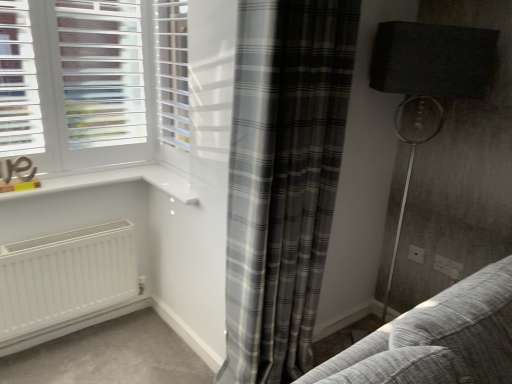
Question: Does white plastic blinds at upper center have a lesser height compared to matte black lampshade at right?

Choices:
 (A) no
 (B) yes

Answer: (B)

Question: Is white plastic blinds at upper center outside matte black lampshade at right?

Choices:
 (A) no
 (B) yes

Answer: (B)

Question: Does white plastic blinds at upper center have a lesser width compared to matte black lampshade at right?

Choices:
 (A) no
 (B) yes

Answer: (B)

Question: Is white plastic blinds at upper center in front of matte black lampshade at right?

Choices:
 (A) no
 (B) yes

Answer: (A)

Question: Is white plastic blinds at upper center bigger than matte black lampshade at right?

Choices:
 (A) no
 (B) yes

Answer: (A)

Question: From the image's perspective, relative to matte black lampshade at right, is gray plaid curtain at center above or below?

Choices:
 (A) below
 (B) above

Answer: (A)

Question: In terms of height, does gray plaid curtain at center look taller or shorter compared to matte black lampshade at right?

Choices:
 (A) short
 (B) tall

Answer: (B)

Question: Considering the relative positions of gray plaid curtain at center and matte black lampshade at right in the image provided, is gray plaid curtain at center to the left or to the right of matte black lampshade at right?

Choices:
 (A) left
 (B) right

Answer: (A)

Question: From a real-world perspective, is gray plaid curtain at center positioned above or below matte black lampshade at right?

Choices:
 (A) above
 (B) below

Answer: (A)

Question: Based on their positions, is matte black lampshade at right located to the left or right of white plastic electric outlet at lower right, the first electric outlet in the right-to-left sequence?

Choices:
 (A) left
 (B) right

Answer: (A)

Question: From the image's perspective, relative to white plastic electric outlet at lower right, the first electric outlet in the right-to-left sequence, is matte black lampshade at right above or below?

Choices:
 (A) above
 (B) below

Answer: (A)

Question: Is matte black lampshade at right spatially inside white plastic electric outlet at lower right, the first electric outlet in the right-to-left sequence, or outside of it?

Choices:
 (A) outside
 (B) inside

Answer: (A)

Question: Is point (468, 29) positioned closer to the camera than point (451, 276)?

Choices:
 (A) farther
 (B) closer

Answer: (B)

Question: Considering the positions of white plastic electric outlet at lower right, acting as the 1th electric outlet starting from the back, and matte black lampshade at right in the image, is white plastic electric outlet at lower right, acting as the 1th electric outlet starting from the back, taller or shorter than matte black lampshade at right?

Choices:
 (A) tall
 (B) short

Answer: (B)

Question: In terms of size, does white plastic electric outlet at lower right, the second electric outlet when ordered from right to left, appear bigger or smaller than matte black lampshade at right?

Choices:
 (A) big
 (B) small

Answer: (B)